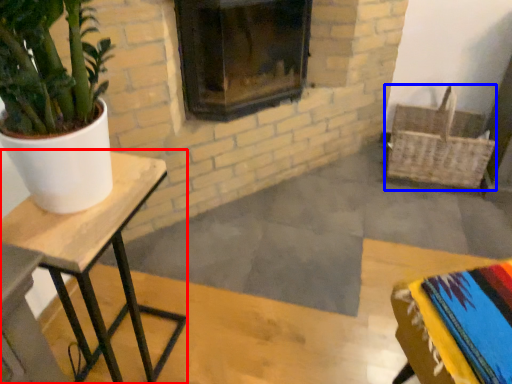
Question: Among these objects, which one is farthest to the camera, table (highlighted by a red box) or basket (highlighted by a blue box)?

Choices:
 (A) table
 (B) basket

Answer: (B)